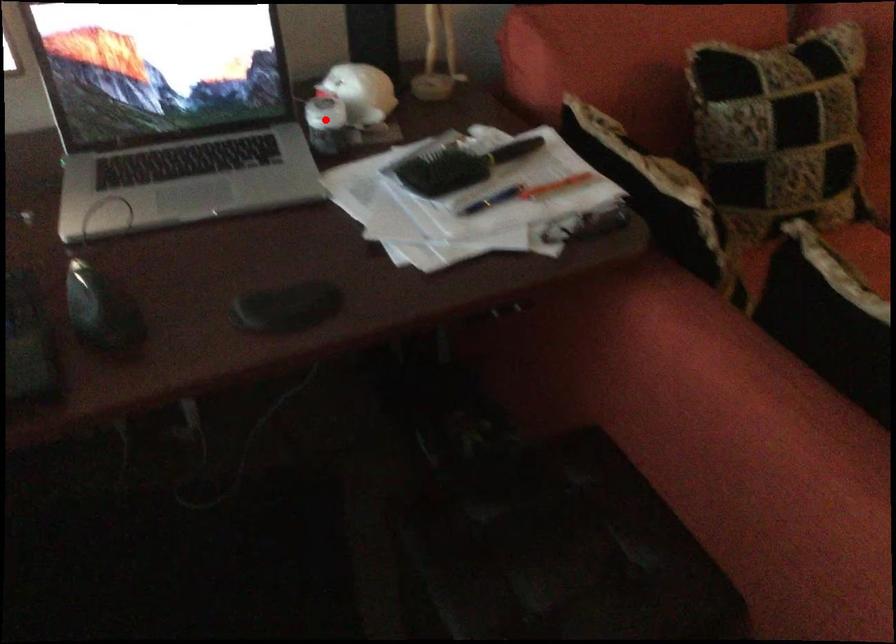
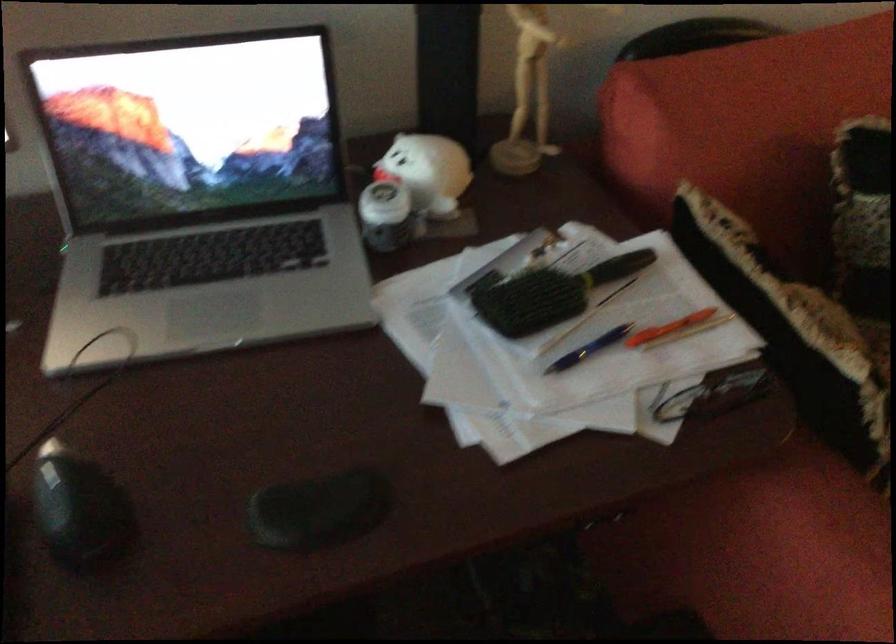
Locate, in the second image, the point that corresponds to the highlighted location in the first image.

(383, 216)